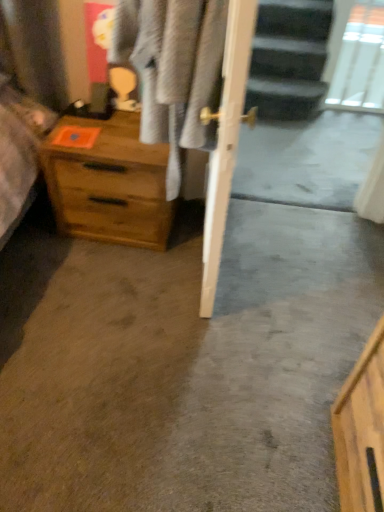
Question: From a real-world perspective, is transparent glass door at upper right above or below light gray fabric at center?

Choices:
 (A) above
 (B) below

Answer: (B)

Question: Considering the positions of transparent glass door at upper right and light gray fabric at center in the image, is transparent glass door at upper right bigger or smaller than light gray fabric at center?

Choices:
 (A) small
 (B) big

Answer: (A)

Question: Estimate the real-world distances between objects in this image. Which object is closer to the transparent glass door at upper right?

Choices:
 (A) wooden chest of drawers at left
 (B) light gray fabric at center

Answer: (A)

Question: Estimate the real-world distances between objects in this image. Which object is farther from the transparent glass door at upper right?

Choices:
 (A) wooden chest of drawers at left
 (B) light gray fabric at center

Answer: (B)